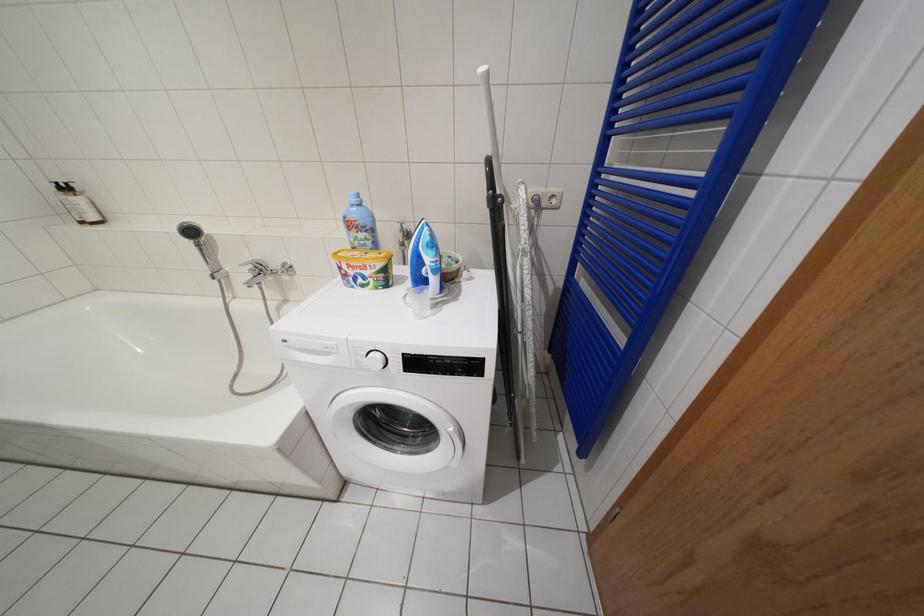
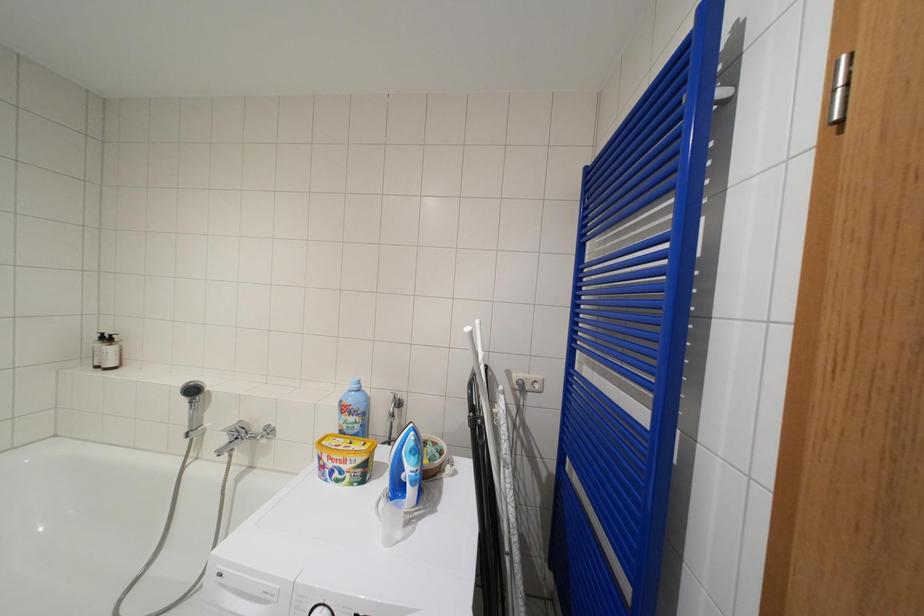
Question: Based on the continuous images, in which direction is the camera rotating? Reply with the corresponding letter.

Choices:
 (A) Left
 (B) Right
 (C) Up
 (D) Down

Answer: (C)